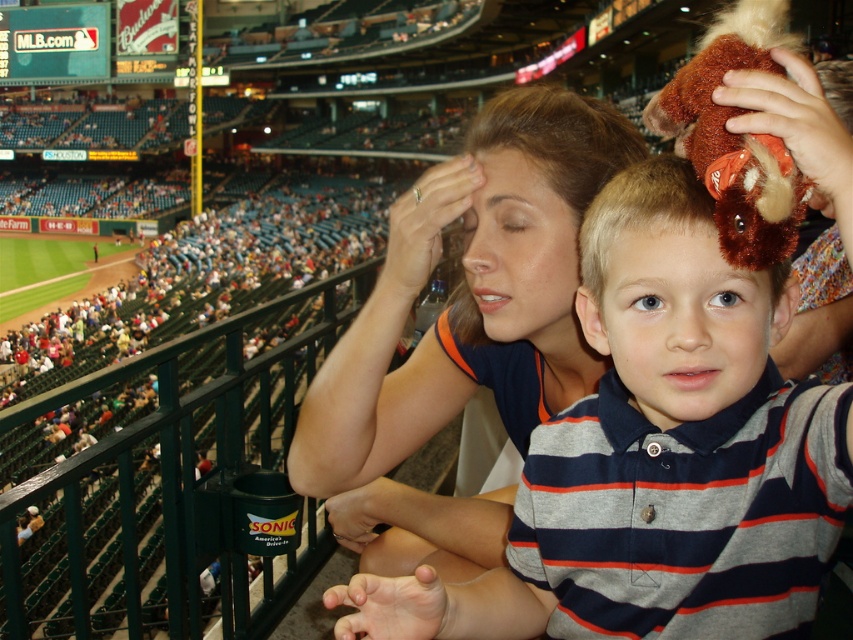
Between matte blue shirt at center and brown plush toy at center, which one appears on the right side from the viewer's perspective?

Positioned to the right is brown plush toy at center.

Does point (468, 364) come farther from viewer compared to point (706, 204)?

Yes, point (468, 364) is behind point (706, 204).

Who is more forward, (364,403) or (582,321)?

Point (582,321) is more forward.

What are the coordinates of `matte blue shirt at center` in the screenshot? It's located at click(x=463, y=330).

How far apart are matte blue shirt at center and striped cotton shirt at center?

6.36 feet

Does matte blue shirt at center lie in front of striped cotton shirt at center?

No, it is behind striped cotton shirt at center.

At what (x,y) coordinates should I click in order to perform the action: click on matte blue shirt at center. Please return your answer as a coordinate pair (x, y). Looking at the image, I should click on (463, 330).

Is striped cotton shirt at center wider than brown plush toy at center?

Correct, the width of striped cotton shirt at center exceeds that of brown plush toy at center.

Does striped cotton shirt at center have a larger size compared to brown plush toy at center?

Yes, striped cotton shirt at center is bigger than brown plush toy at center.

You are a GUI agent. You are given a task and a screenshot of the screen. Output one action in this format:
    pyautogui.click(x=<x>, y=<y>)
    Task: Click on the striped cotton shirt at center
    
    Given the screenshot: What is the action you would take?
    pyautogui.click(x=672, y=298)